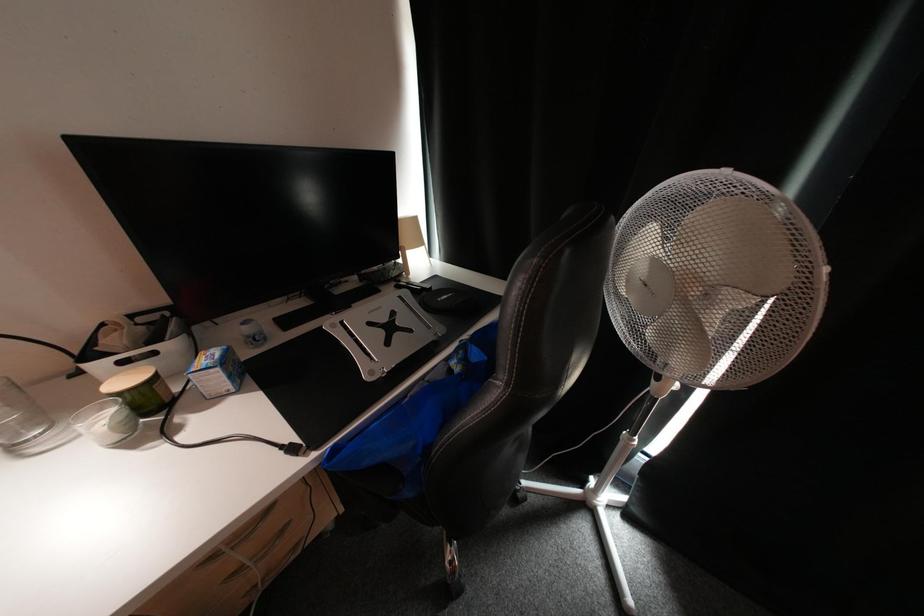
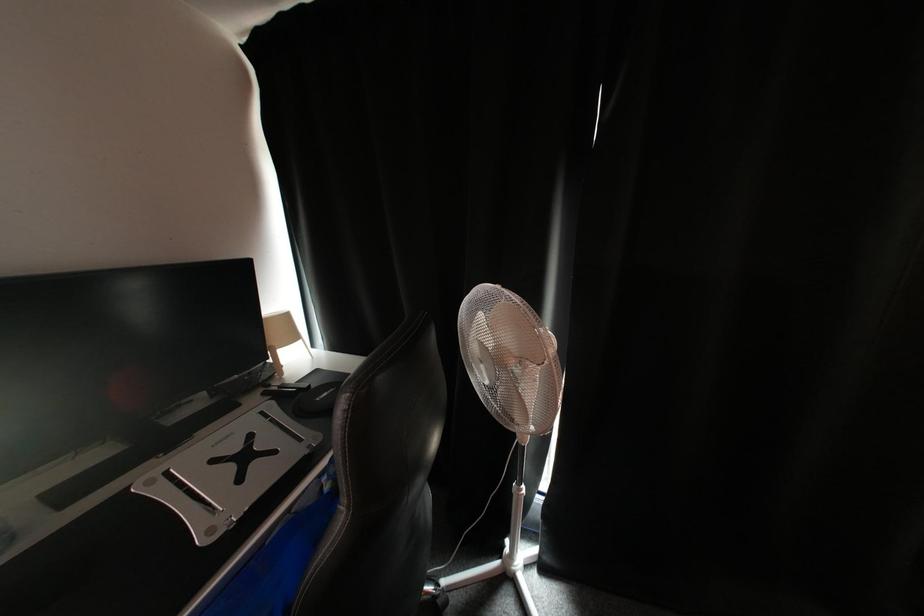
Question: The camera is either moving clockwise (left) or counter-clockwise (right) around the object. The first image is from the beginning of the video and the second image is from the end. Is the camera moving left or right when shooting the video?

Choices:
 (A) Left
 (B) Right

Answer: (A)